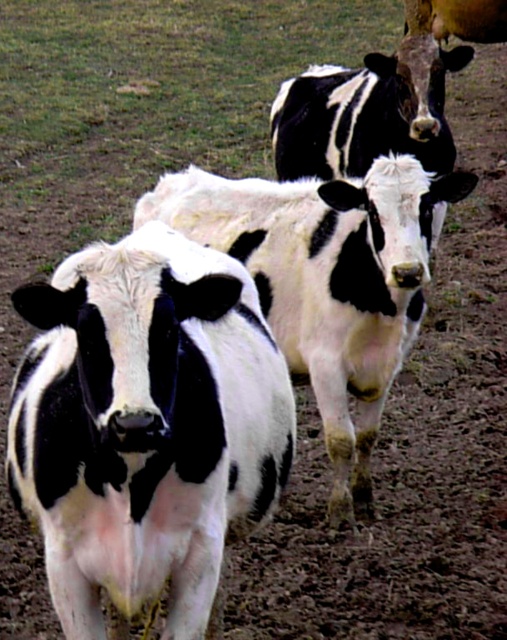
Looking at this image, you are a farmer checking on your cows. You notice the black and white fur at center and the black and white cow at center. Which one is closer to the ground?

The black and white fur at center is located below the black and white cow at center, so the black and white fur at center is closer to the ground.

You are a farmer checking the health of your cows. You notice that the black and white fur at center and the black and white cow at center are both in the same area. Which one has a smaller width?

The black and white fur at center has a smaller width than the black and white cow at center.